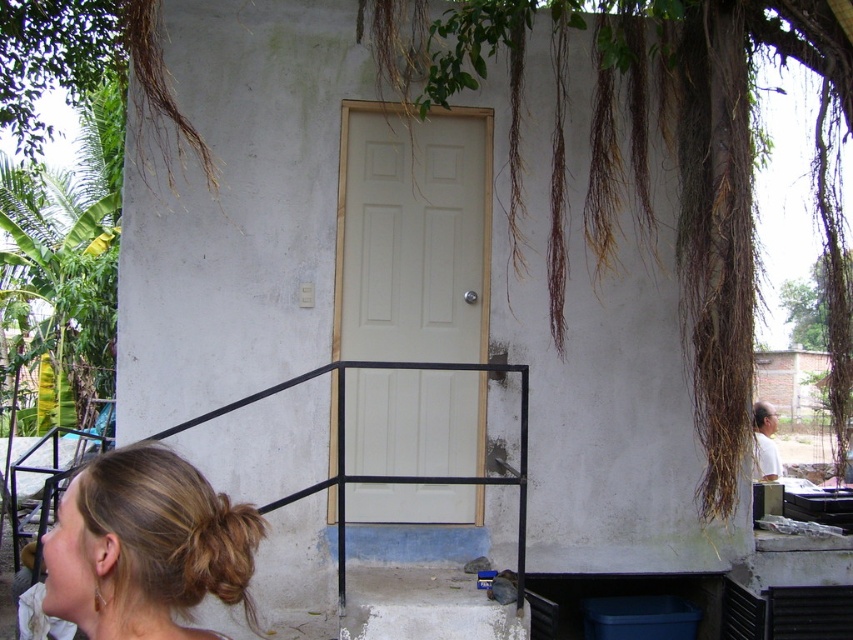
Question: Is concrete stairs at lower center to the left of brown fuzzy hair at lower left from the viewer's perspective?

Choices:
 (A) no
 (B) yes

Answer: (A)

Question: Is blonde hair at lower left to the left of brown fuzzy hair at lower left from the viewer's perspective?

Choices:
 (A) yes
 (B) no

Answer: (A)

Question: From the image, what is the correct spatial relationship of white matte door at center in relation to brown fuzzy hair at lower left?

Choices:
 (A) below
 (B) above

Answer: (B)

Question: Which point appears farthest from the camera in this image?

Choices:
 (A) (386, 632)
 (B) (172, 550)
 (C) (759, 420)
 (D) (248, 401)

Answer: (C)

Question: Which of these objects is positioned farthest from the white matte door at center?

Choices:
 (A) white matte man at right
 (B) black metal rail at lower center
 (C) blonde hair at lower left

Answer: (C)

Question: Among these objects, which one is farthest from the camera?

Choices:
 (A) concrete stairs at lower center
 (B) white matte door at center
 (C) black metal rail at lower center

Answer: (B)